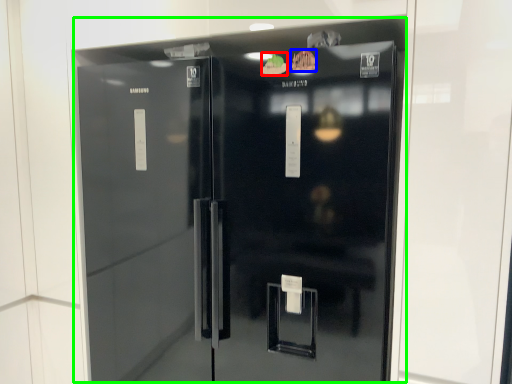
Question: Which is farther away from food (highlighted by a red box)? food (highlighted by a blue box) or refrigerator (highlighted by a green box)?

Choices:
 (A) food
 (B) refrigerator

Answer: (B)